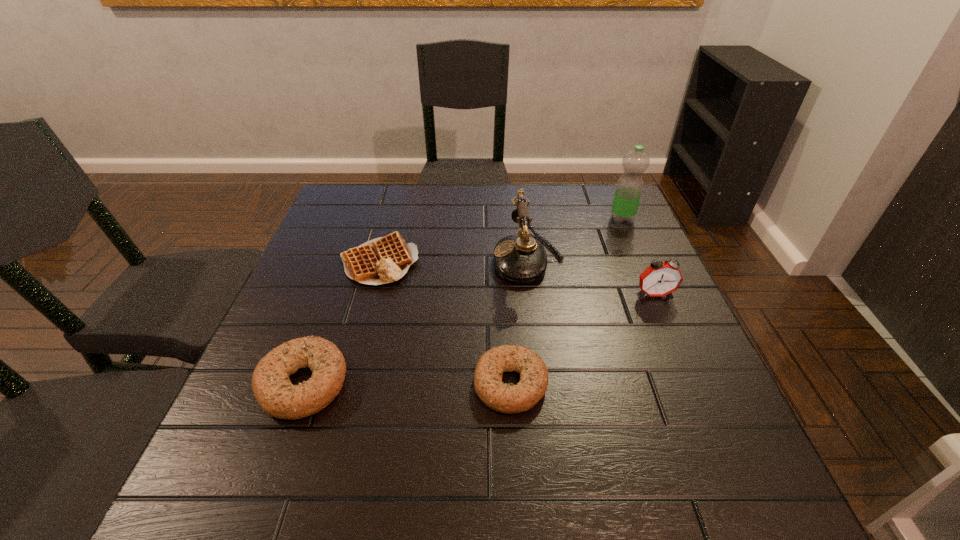
I want to click on vacant space that is in between the waffle and the fourth tallest object, so click(x=341, y=323).

Where is `free point between the left bagel and the fourth shortest object`? free point between the left bagel and the fourth shortest object is located at coordinates (479, 339).

I want to click on vacant space in between the second tallest object and the right bagel, so click(x=519, y=321).

Where is `vacant space that is in between the alarm clock and the left bagel`? vacant space that is in between the alarm clock and the left bagel is located at coordinates (479, 339).

Identify the location of vacant region between the right bagel and the left bagel. Image resolution: width=960 pixels, height=540 pixels. (407, 383).

The image size is (960, 540). What are the coordinates of `the closest object to the waffle` in the screenshot? It's located at (276, 395).

You are a GUI agent. You are given a task and a screenshot of the screen. Output one action in this format:
    pyautogui.click(x=<x>, y=<y>)
    Task: Click on the object that stands as the closest to the third tallest object
    
    Given the screenshot: What is the action you would take?
    pyautogui.click(x=521, y=259)

At what (x,y) coordinates should I click in order to perform the action: click on vacant region that satisfies the following two spatial constraints: 1. on the dial of the telephone; 2. on the front side of the shorter bagel. Please return your answer as a coordinate pair (x, y). This screenshot has height=540, width=960. Looking at the image, I should click on (545, 383).